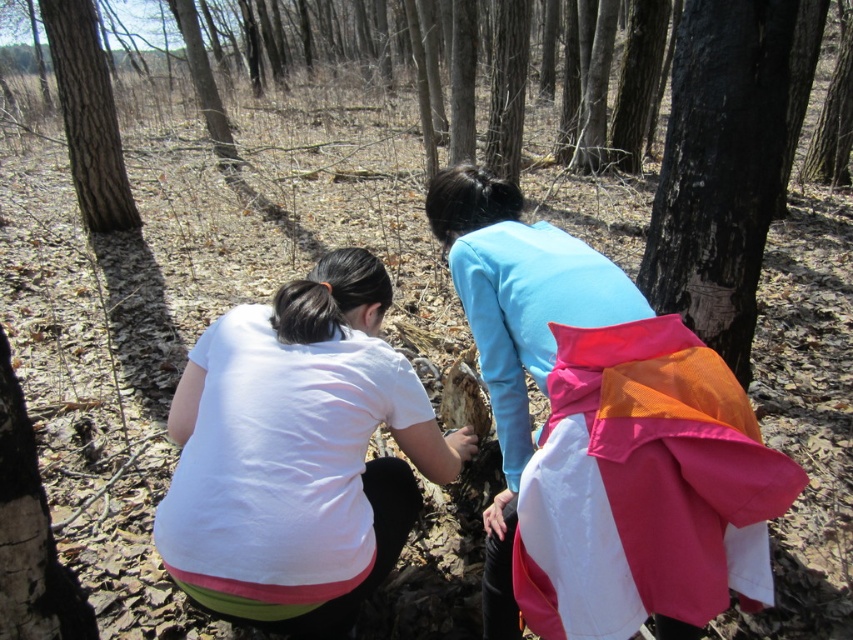
Is point (718, 218) closer to camera compared to point (61, 40)?

Yes, it is.

Does black rough bark at center have a lesser width compared to rough bark tree at upper left?

Yes.

Is point (693, 106) positioned after point (86, 49)?

No, (693, 106) is closer to viewer.

Where is `black rough bark at center`? black rough bark at center is located at coordinates (724, 164).

Does point (229, 349) come behind point (724, 122)?

That is False.

Can you confirm if white matte shirt at lower left is wider than black rough bark at center?

Indeed, white matte shirt at lower left has a greater width compared to black rough bark at center.

Identify the location of white matte shirt at lower left. The height and width of the screenshot is (640, 853). (299, 454).

Looking at this image, is white matte shirt at lower left wider than rough bark tree at upper left?

Correct, the width of white matte shirt at lower left exceeds that of rough bark tree at upper left.

How far apart are white matte shirt at lower left and rough bark tree at upper left?

A distance of 5.41 meters exists between white matte shirt at lower left and rough bark tree at upper left.

Is point (341, 310) farther from viewer compared to point (96, 68)?

No, (341, 310) is in front of (96, 68).

Where is `white matte shirt at lower left`? white matte shirt at lower left is located at coordinates pos(299,454).